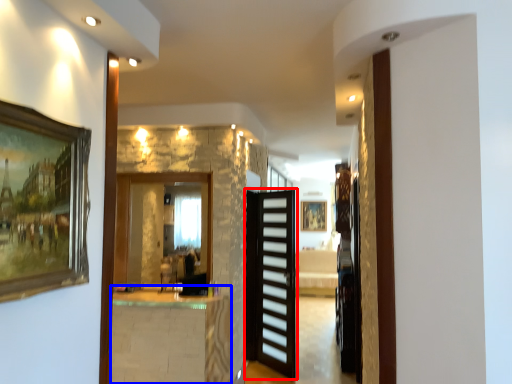
Question: Which object is closer to the camera taking this photo, door (highlighted by a red box) or table (highlighted by a blue box)?

Choices:
 (A) door
 (B) table

Answer: (B)